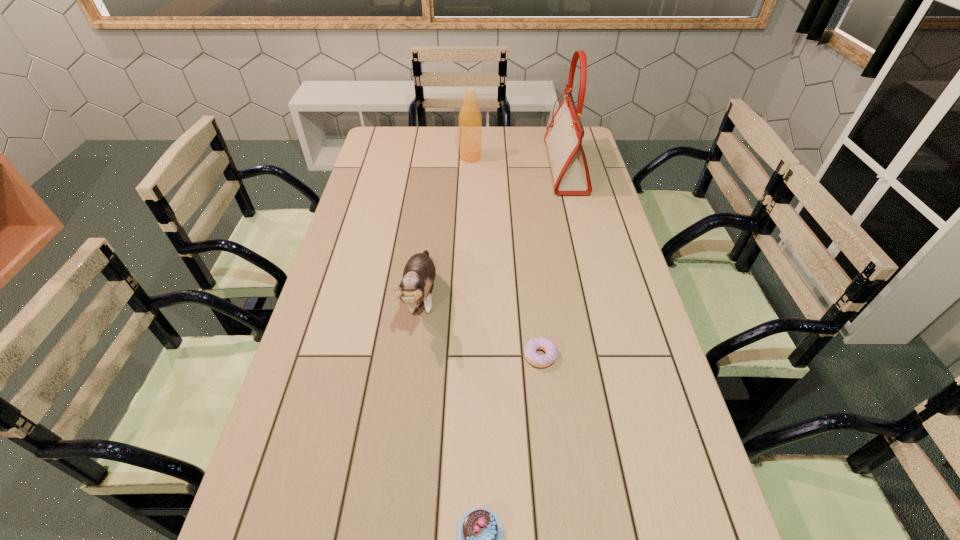
This screenshot has width=960, height=540. I want to click on vacant space positioned 0.360m on the back of the second object from right to left, so click(x=528, y=251).

The width and height of the screenshot is (960, 540). I want to click on handbag that is positioned at the far edge, so click(x=564, y=135).

You are a GUI agent. You are given a task and a screenshot of the screen. Output one action in this format:
    pyautogui.click(x=<x>, y=<y>)
    Task: Click on the beer bottle that is at the far edge
    The height and width of the screenshot is (540, 960).
    Given the screenshot: What is the action you would take?
    pyautogui.click(x=470, y=120)

Where is `object at the right edge`? The width and height of the screenshot is (960, 540). object at the right edge is located at coordinates [x=564, y=135].

You are a GUI agent. You are given a task and a screenshot of the screen. Output one action in this format:
    pyautogui.click(x=<x>, y=<y>)
    Task: Click on the object present at the far right corner
    This screenshot has width=960, height=540.
    Given the screenshot: What is the action you would take?
    pyautogui.click(x=564, y=135)

Locate an element on the screen. The width and height of the screenshot is (960, 540). free point at the far edge is located at coordinates (543, 134).

This screenshot has height=540, width=960. What are the coordinates of `vacant space at the left edge of the desktop` in the screenshot? It's located at (312, 363).

In the image, there is a desktop. Identify the location of blank space at the right edge. The height and width of the screenshot is (540, 960). (594, 287).

Image resolution: width=960 pixels, height=540 pixels. In the image, there is a desktop. What are the coordinates of `vacant space at the far left corner` in the screenshot? It's located at (375, 131).

I want to click on free space between the handbag and the third shortest object, so click(x=493, y=232).